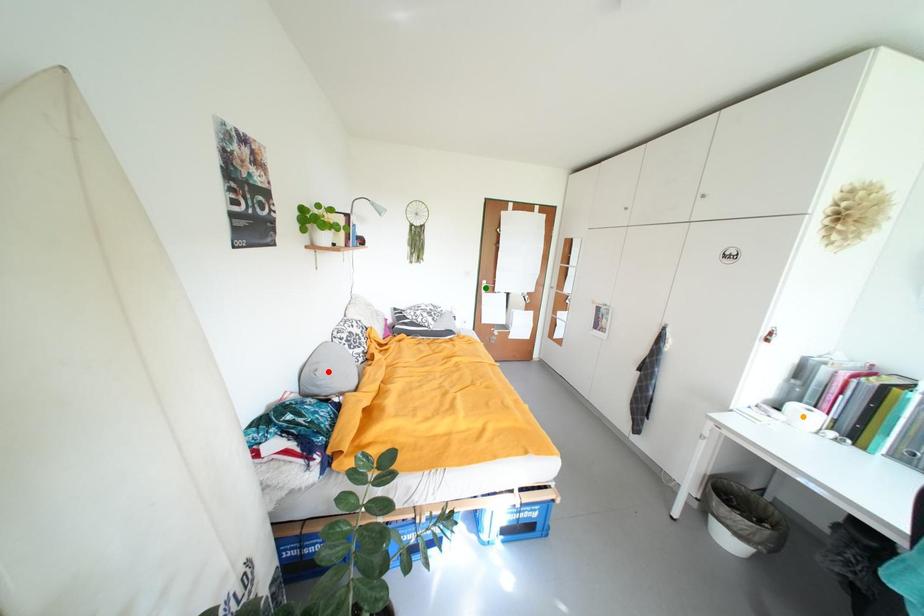
Looking at this image, order these from nearest to farthest:
A) orange point
B) red point
C) green point

green point < red point < orange point